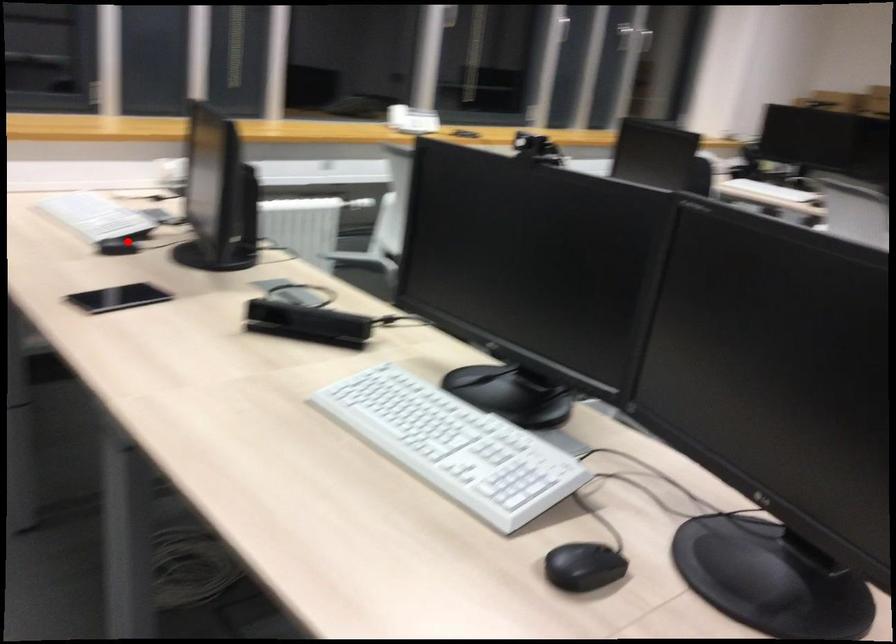
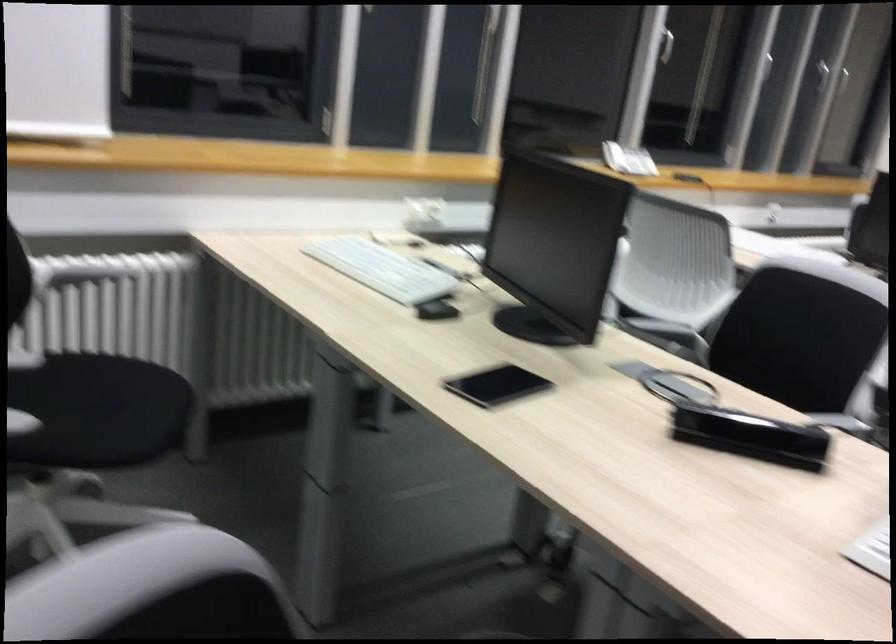
In the second image, find the point that corresponds to the highlighted location in the first image.

(435, 297)